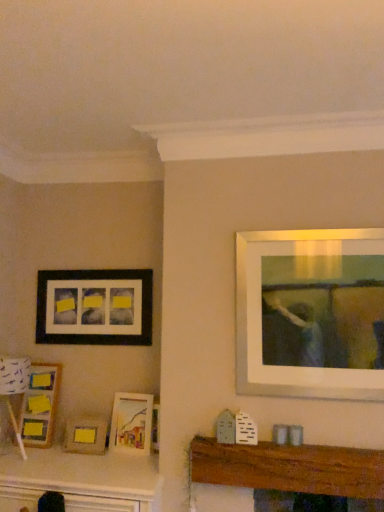
Where is `empty space that is ontop of wooden mantel at center (from a real-world perspective)`? Image resolution: width=384 pixels, height=512 pixels. empty space that is ontop of wooden mantel at center (from a real-world perspective) is located at coordinates (307, 430).